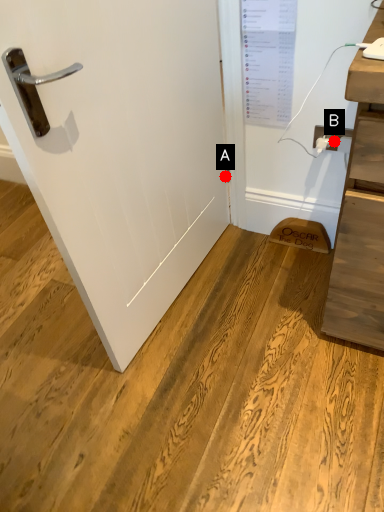
Question: Two points are circled on the image, labeled by A and B beside each circle. Which point is closer to the camera taking this photo?

Choices:
 (A) A is closer
 (B) B is closer

Answer: (B)